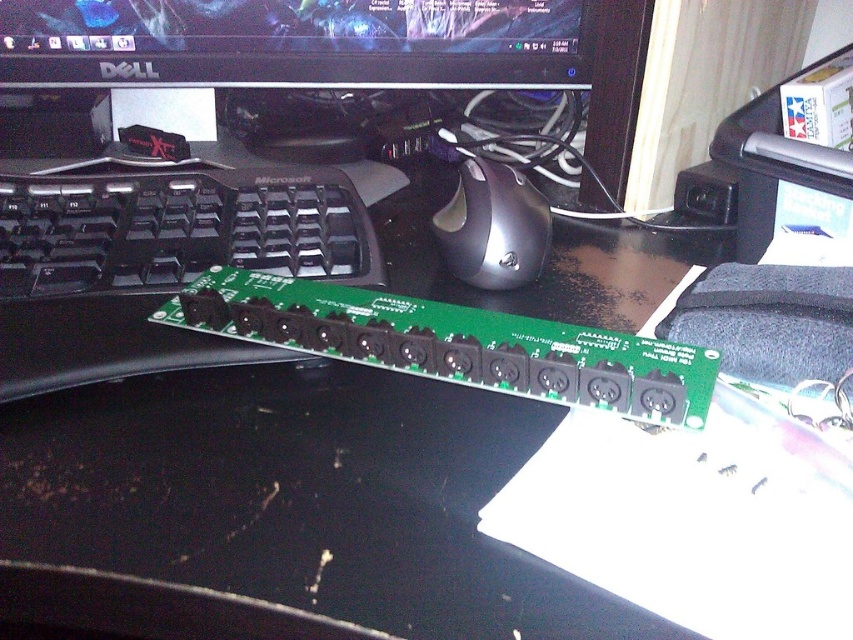
Question: Is black glossy monitor at upper center positioned in front of black matte keyboard at left?

Choices:
 (A) yes
 (B) no

Answer: (B)

Question: Is black matte keyboard at left above black matte mouse at center?

Choices:
 (A) yes
 (B) no

Answer: (A)

Question: Considering the real-world distances, which object is closest to the black matte mouse at center?

Choices:
 (A) black glossy monitor at upper center
 (B) black matte keyboard at left

Answer: (B)

Question: Which object is positioned farthest from the black glossy monitor at upper center?

Choices:
 (A) black matte mouse at center
 (B) black matte keyboard at left

Answer: (A)

Question: In this image, where is black glossy monitor at upper center located relative to black matte mouse at center?

Choices:
 (A) left
 (B) right

Answer: (A)

Question: Estimate the real-world distances between objects in this image. Which object is closer to the black matte mouse at center?

Choices:
 (A) black matte keyboard at left
 (B) black glossy monitor at upper center

Answer: (A)